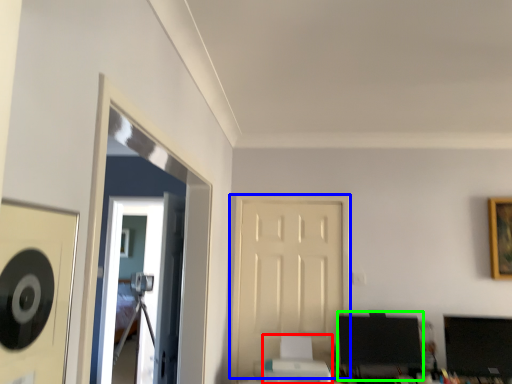
Question: Which is farther away from printer (highlighted by a red box)? door (highlighted by a blue box) or computer monitor (highlighted by a green box)?

Choices:
 (A) door
 (B) computer monitor

Answer: (A)